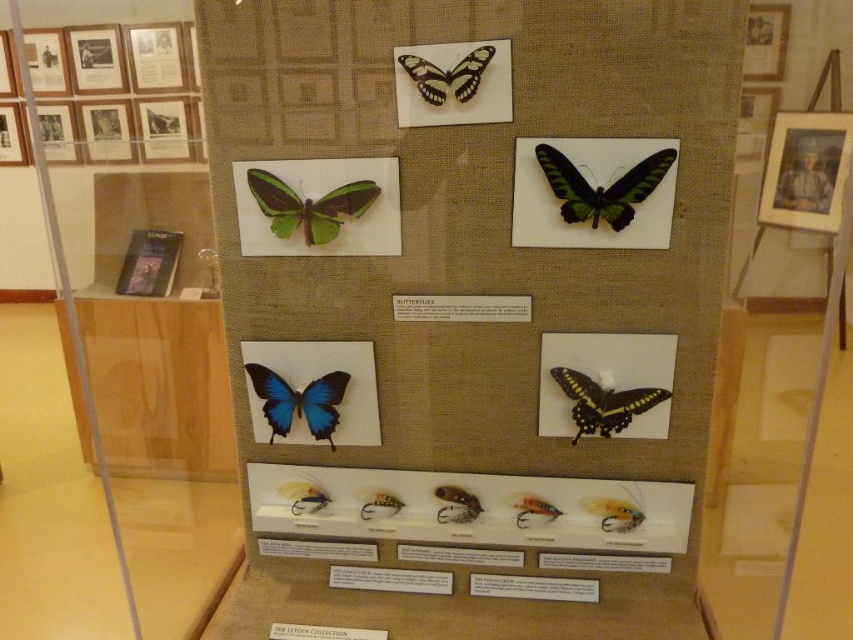
Who is lower down, white matte butterfly at upper center or translucent yellow-green butterfly at center?

translucent yellow-green butterfly at center

Who is more forward, [480,45] or [619,483]?

Point [480,45] is in front.

The image size is (853, 640). In order to click on white matte butterfly at upper center in this screenshot , I will do `click(447, 74)`.

Locate an element on the screen. white matte butterfly at upper center is located at coordinates (447, 74).

Is green matte butterfly at upper center bigger than yellow-green iridescent butterfly at lower right?

No.

Does green matte butterfly at upper center appear on the left side of yellow-green iridescent butterfly at lower right?

Correct, you'll find green matte butterfly at upper center to the left of yellow-green iridescent butterfly at lower right.

The height and width of the screenshot is (640, 853). What do you see at coordinates (309, 205) in the screenshot?
I see `green matte butterfly at upper center` at bounding box center [309, 205].

In order to click on green matte butterfly at upper center in this screenshot , I will do `click(309, 205)`.

Who is positioned more to the left, green matte butterfly at upper center or translucent orange fly at center?

Positioned to the left is green matte butterfly at upper center.

Between green matte butterfly at upper center and translucent orange fly at center, which one is positioned lower?

translucent orange fly at center

Between point (322, 234) and point (556, 512), which one is positioned in front?

Point (322, 234) is more forward.

What are the coordinates of `green matte butterfly at upper center` in the screenshot? It's located at (309, 205).